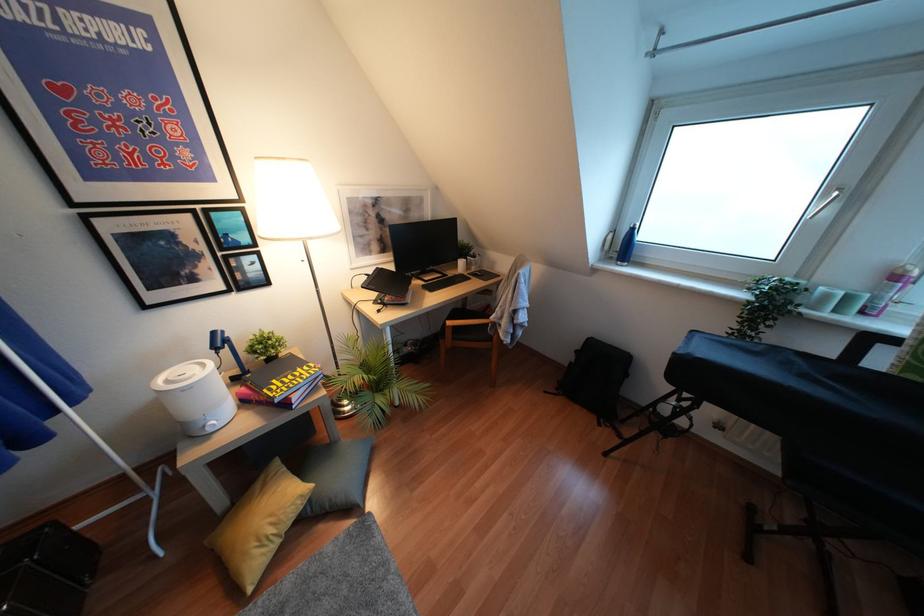
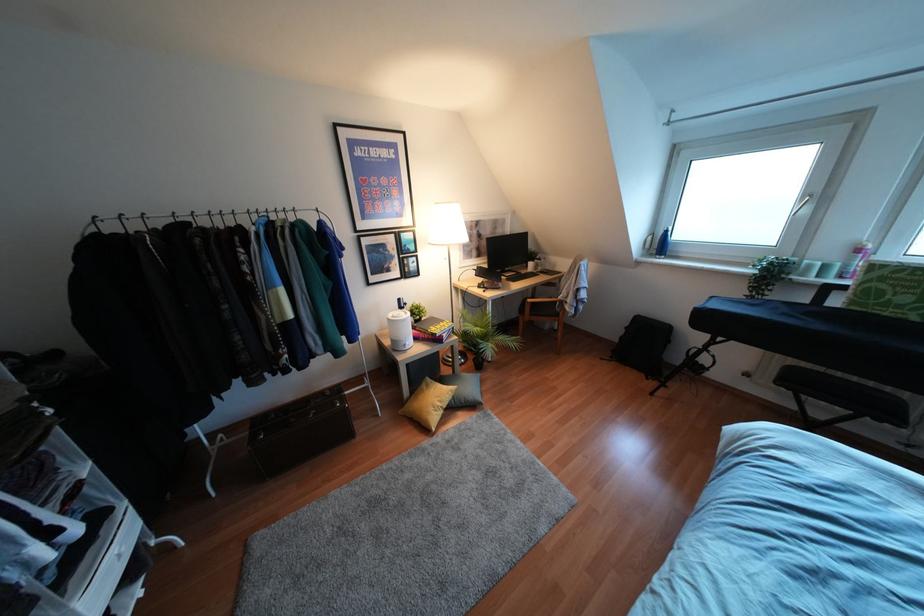
Find the pixel in the second image that matches (895,277) in the first image.

(858, 249)